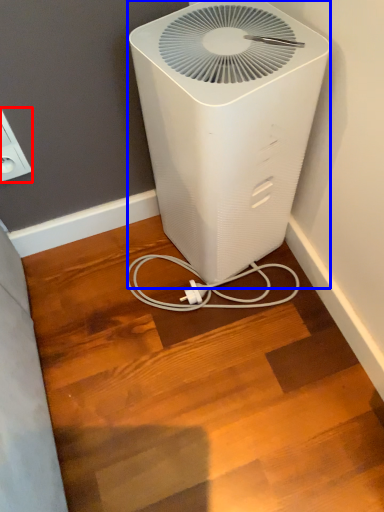
Question: Among these objects, which one is farthest to the camera, electric outlet (highlighted by a red box) or home appliance (highlighted by a blue box)?

Choices:
 (A) electric outlet
 (B) home appliance

Answer: (A)